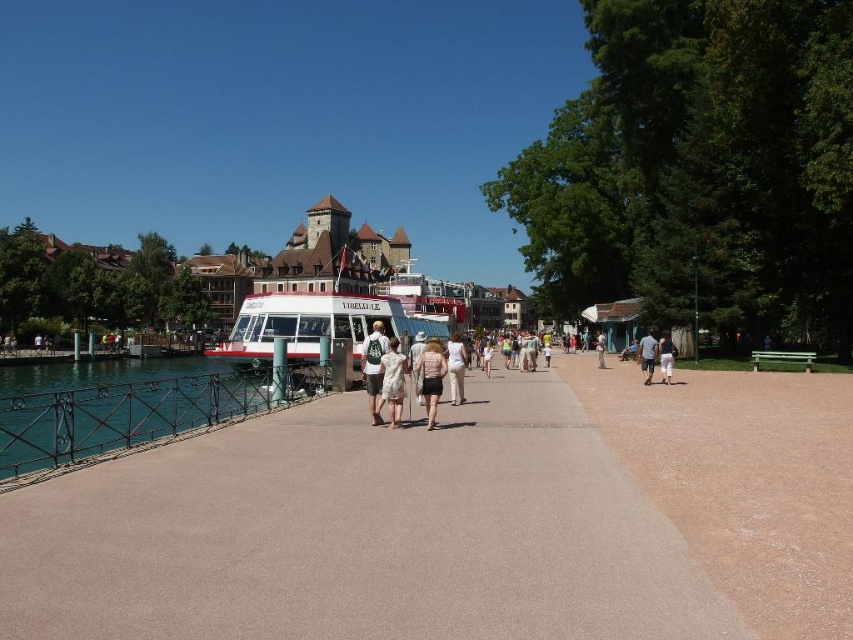
Is floral dress at center closer to camera compared to green painted wood bench at lower right?

That is True.

How much distance is there between floral dress at center and green painted wood bench at lower right?

129.37 feet

What do you see at coordinates (393, 380) in the screenshot?
I see `floral dress at center` at bounding box center [393, 380].

Find the location of a particular element. Image resolution: width=853 pixels, height=640 pixels. floral dress at center is located at coordinates (393, 380).

This screenshot has width=853, height=640. Identify the location of brown gravel path at right. (743, 481).

Does brown gravel path at right have a greater height compared to white cotton backpack at center?

No.

What do you see at coordinates (743, 481) in the screenshot? I see `brown gravel path at right` at bounding box center [743, 481].

Image resolution: width=853 pixels, height=640 pixels. Identify the location of brown gravel path at right. (743, 481).

Does brown concrete pavement at center appear under dark blue jeans at center?

Yes, brown concrete pavement at center is below dark blue jeans at center.

Between brown concrete pavement at center and dark blue jeans at center, which one is positioned lower?

Positioned lower is brown concrete pavement at center.

This screenshot has height=640, width=853. In order to click on brown concrete pavement at center in this screenshot , I will do `click(358, 532)`.

Find the location of a particular element. The image size is (853, 640). brown concrete pavement at center is located at coordinates (358, 532).